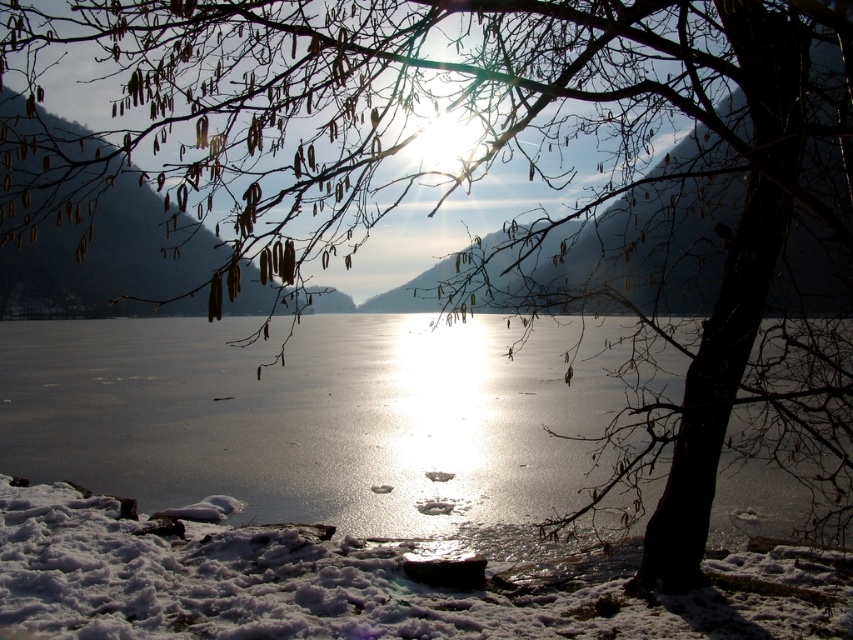
Which is more to the right, transparent ice at center or white fluffy snow at lower left?

white fluffy snow at lower left

Where is `transparent ice at center`? The width and height of the screenshot is (853, 640). transparent ice at center is located at coordinates (311, 417).

Describe the element at coordinates (311, 417) in the screenshot. I see `transparent ice at center` at that location.

This screenshot has height=640, width=853. Identify the location of transparent ice at center. (311, 417).